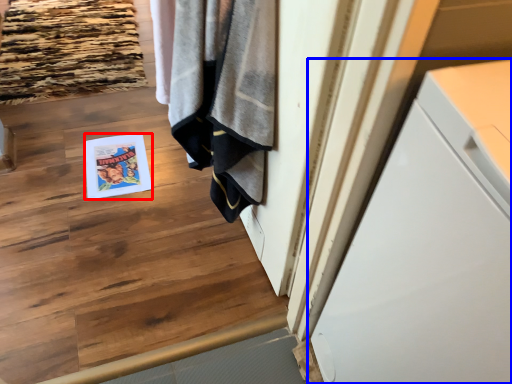
Question: Which object is further to the camera taking this photo, magazine (highlighted by a red box) or cabinetry (highlighted by a blue box)?

Choices:
 (A) magazine
 (B) cabinetry

Answer: (A)